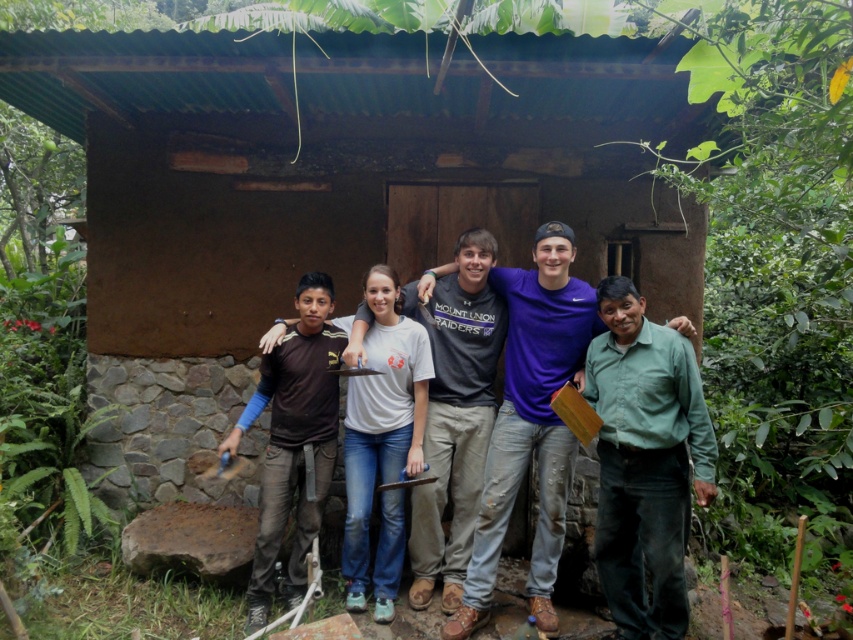
You are standing in front of the rustic structure and want to determine which of the two points, point (616, 518) or point (483, 380), is nearer to you. Based on the scene, which point is closer?

Point (616, 518) is closer to the viewer than point (483, 380).